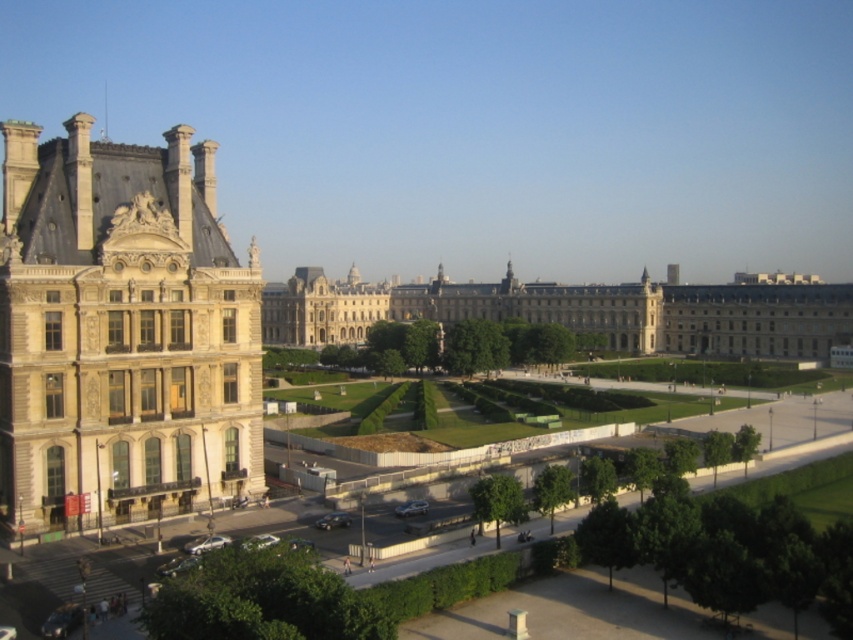
Is beige stone palace at left above light beige stone building at center?

Incorrect, beige stone palace at left is not positioned above light beige stone building at center.

Does beige stone palace at left have a smaller size compared to light beige stone building at center?

Correct, beige stone palace at left occupies less space than light beige stone building at center.

Is point (73, 150) closer to viewer compared to point (715, 298)?

Yes, it is.

I want to click on beige stone palace at left, so click(x=122, y=333).